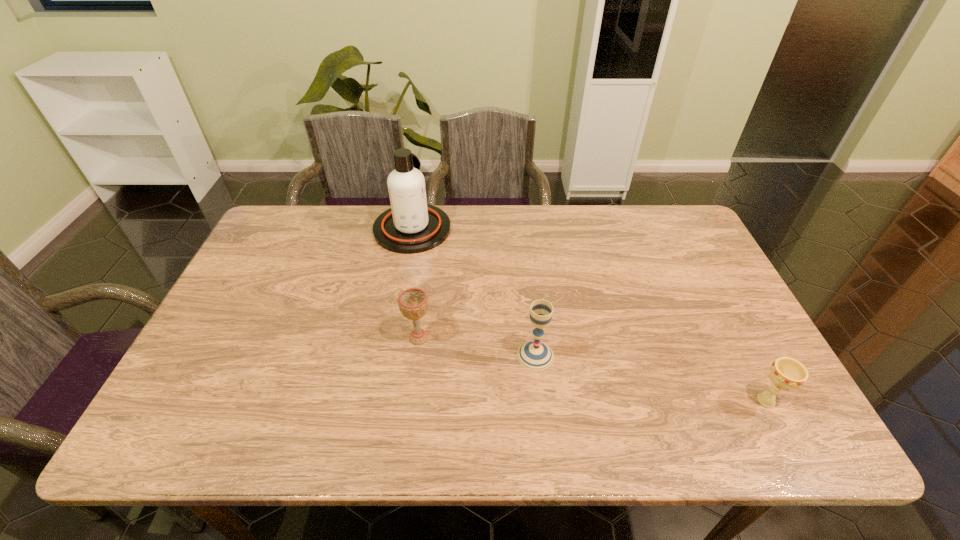
The image size is (960, 540). What are the coordinates of `vacant space in between the rightmost chalice and the cleansing agent` in the screenshot? It's located at (589, 315).

Image resolution: width=960 pixels, height=540 pixels. Find the location of `free space between the shortest chalice and the cleansing agent`. free space between the shortest chalice and the cleansing agent is located at coordinates (589, 315).

Where is `vacant area that lies between the leftmost chalice and the second chalice from right to left`? The height and width of the screenshot is (540, 960). vacant area that lies between the leftmost chalice and the second chalice from right to left is located at coordinates (477, 347).

Find the location of a particular element. Image resolution: width=960 pixels, height=540 pixels. blank region between the leftmost chalice and the nearest chalice is located at coordinates (592, 369).

Find the location of a particular element. The image size is (960, 540). free spot between the leftmost chalice and the farthest object is located at coordinates (416, 284).

I want to click on vacant area between the nearest object and the leftmost chalice, so click(592, 369).

Find the location of a particular element. The image size is (960, 540). free space that is in between the tallest object and the leftmost chalice is located at coordinates (416, 284).

Locate an element on the screen. The height and width of the screenshot is (540, 960). unoccupied area between the second object from right to left and the leftmost chalice is located at coordinates (477, 347).

The image size is (960, 540). In order to click on unoccupied position between the tallest object and the nearest chalice in this screenshot , I will do `click(589, 315)`.

At what (x,y) coordinates should I click in order to perform the action: click on vacant space that is in between the shortest chalice and the tallest object. Please return your answer as a coordinate pair (x, y). This screenshot has width=960, height=540. Looking at the image, I should click on (589, 315).